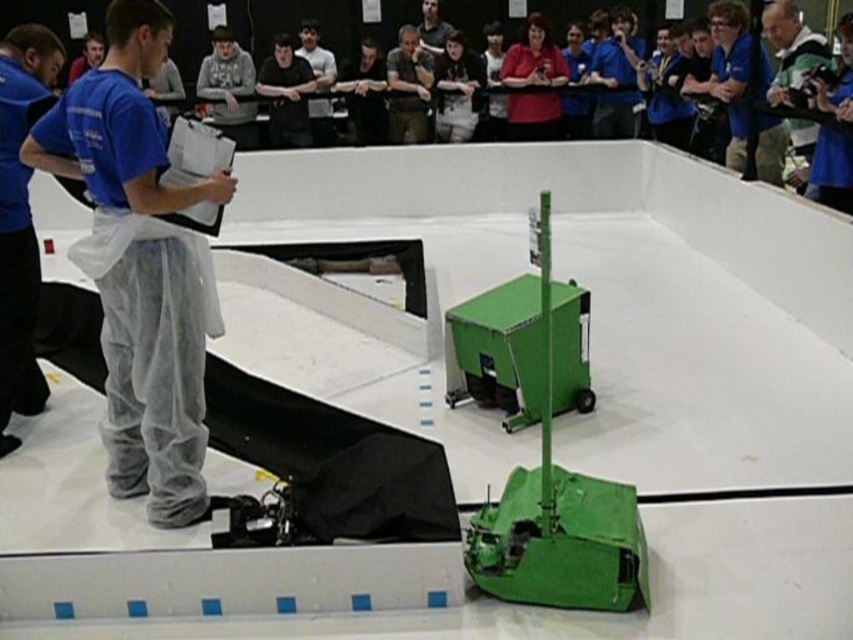
You are a participant in the robotics competition and need to locate the judge who is wearing blue fabric pants at left. According to the arena coordinates, where exactly is the judge standing?

The judge wearing blue fabric pants at left is standing at coordinates point (x=19, y=220).

You are a participant in the robotics competition and need to identify the clothing items of the officials. Which clothing item is larger in size between the blue fabric pants at left and the black cotton shirt at center?

The blue fabric pants at left is bigger than the black cotton shirt at center.